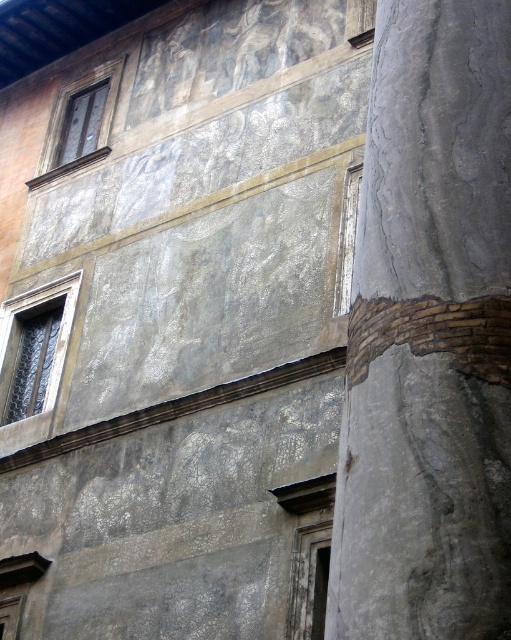
Question: Which point is closer to the camera taking this photo?

Choices:
 (A) (67, 328)
 (B) (347, 180)
 (C) (468, 592)
 (D) (75, 81)

Answer: (C)

Question: Which point is farther from the camera taking this photo?

Choices:
 (A) (434, 16)
 (B) (43, 173)

Answer: (B)

Question: Which point is closer to the camera taking this photo?

Choices:
 (A) (86, 99)
 (B) (472, 35)

Answer: (B)

Question: Does gray stone column at right have a greater width compared to white stone window at center?

Choices:
 (A) yes
 (B) no

Answer: (A)

Question: Where is gray stone column at right located in relation to white stone window at center in the image?

Choices:
 (A) left
 (B) right

Answer: (B)

Question: Where is dark glass window at left located in relation to white stone window at center in the image?

Choices:
 (A) right
 (B) left

Answer: (B)